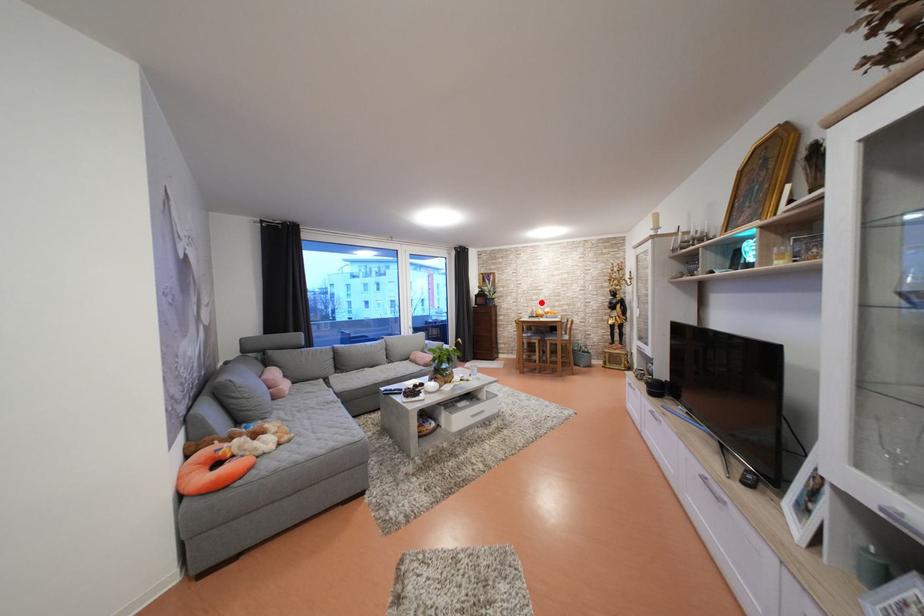
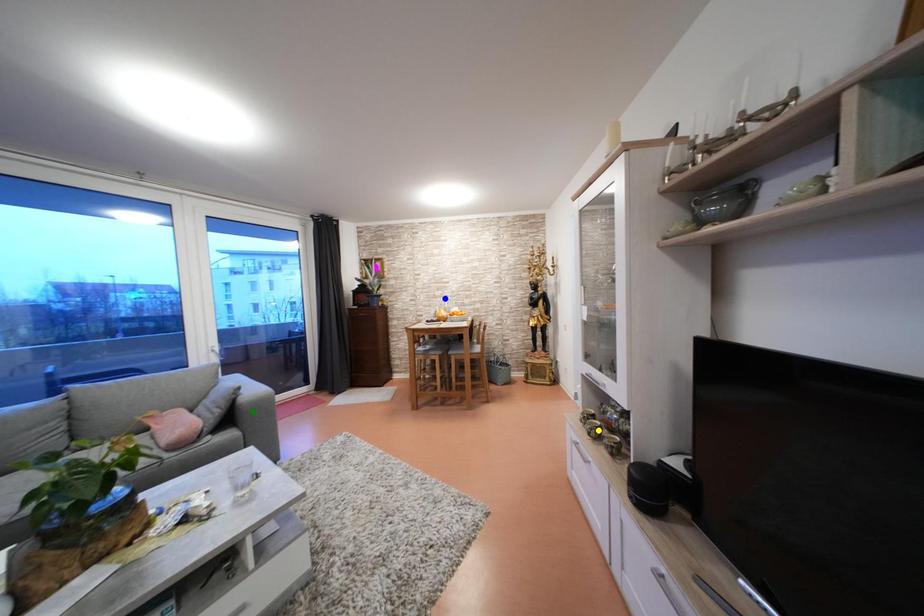
Question: I am providing you with two images of the same scene from different viewpoints. A red point is marked on the first image. You are given multiple points on the second image. Which point in image 2 represents the same 3d spot as the red point in image 1?

Choices:
 (A) yellow point
 (B) blue point
 (C) green point

Answer: (B)